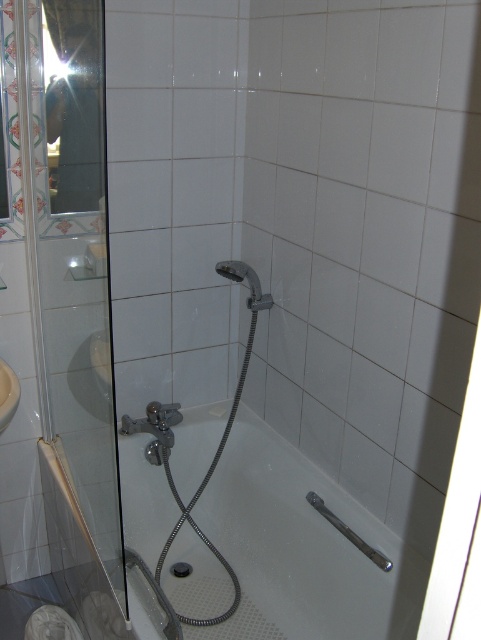
Question: Is silver metallic shower head at center to the left of white matte sink at lower left from the viewer's perspective?

Choices:
 (A) no
 (B) yes

Answer: (A)

Question: Is transparent glass door at left to the right of silver metallic shower head at center from the viewer's perspective?

Choices:
 (A) no
 (B) yes

Answer: (A)

Question: Is transparent glass door at left below white matte sink at lower left?

Choices:
 (A) no
 (B) yes

Answer: (A)

Question: Which object is the closest to the transparent glass door at left?

Choices:
 (A) white glossy bathtub at center
 (B) white matte sink at lower left
 (C) silver metallic shower head at center

Answer: (B)

Question: Which object is closer to the camera taking this photo?

Choices:
 (A) white glossy bathtub at center
 (B) white matte sink at lower left
 (C) silver metallic shower head at center

Answer: (A)

Question: Which object is farther from the camera taking this photo?

Choices:
 (A) white glossy bathtub at center
 (B) white matte sink at lower left
 (C) transparent glass door at left
 (D) silver metallic shower head at center

Answer: (D)